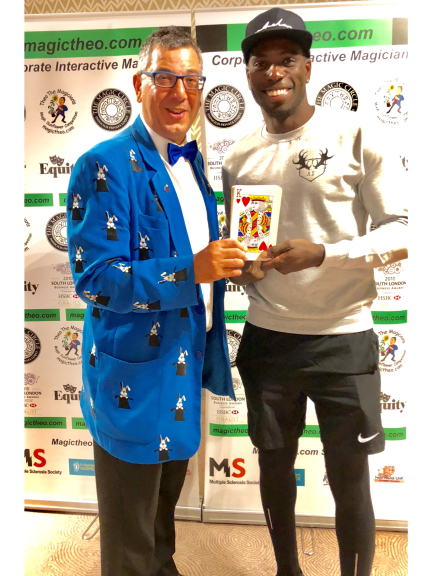
Locate an element on the screen. reflection of light on floor is located at coordinates (36, 529).